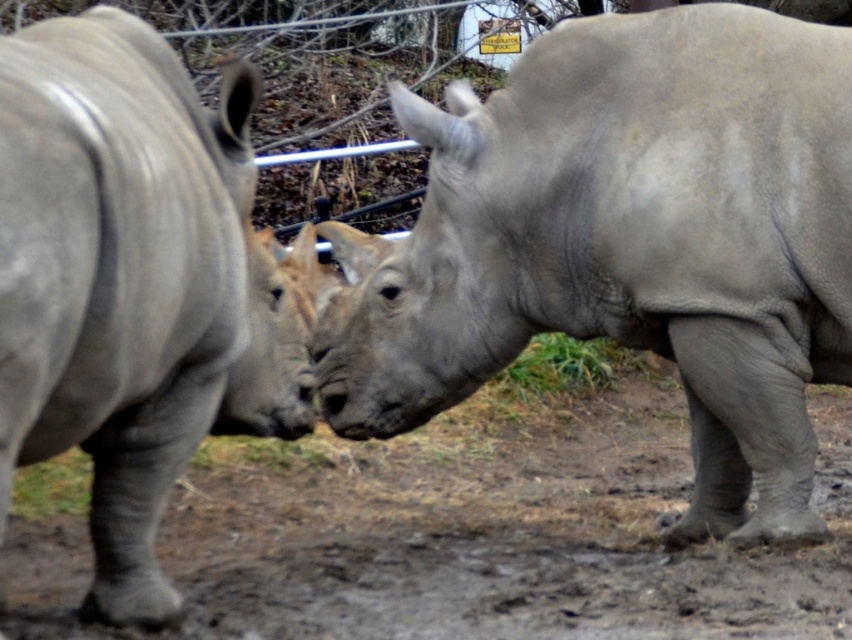
You are a wildlife photographer aiming to capture a clear shot of the gray matte rhinoceros at center. Your camera has a zoom feature that can focus on a specific coordinate point. What are the exact coordinates where you should aim your camera to ensure the rhinoceros is centered in your shot?

The gray matte rhinoceros at center is located at point coordinates of (632, 241). Aim your camera at those coordinates to center it in your shot.

You are a researcher observing two rhinos in the wild. You have coordinates for two points in the image. The first point is at location point (373, 284) and the second is at point (130, 467). Based on your knowledge of the scene, which point is closer to the camera?

Point (130, 467) is closer to the camera because the Objects Description states that point (373, 284) is behind point (130, 467).

You are a wildlife photographer aiming to capture a clear photo of the gray matte rhinoceros at center and the gray matte rhinoceros at left. Which rhinoceros will appear larger in your photo?

The gray matte rhinoceros at center will appear larger in the photo because it is closer to the viewer than the gray matte rhinoceros at left.